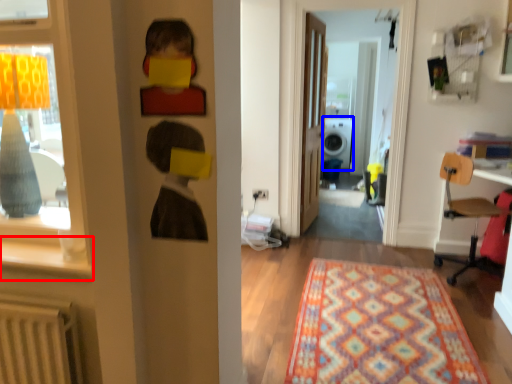
Question: Which point is closer to the camera, window sill (highlighted by a red box) or washer (highlighted by a blue box)?

Choices:
 (A) window sill
 (B) washer

Answer: (A)